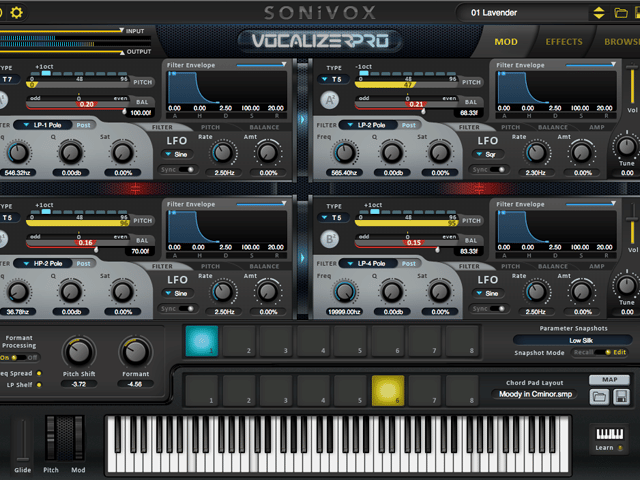
Locate an element on the screen. This screenshot has height=480, width=640. mini keyboard keys is located at coordinates (612, 434).